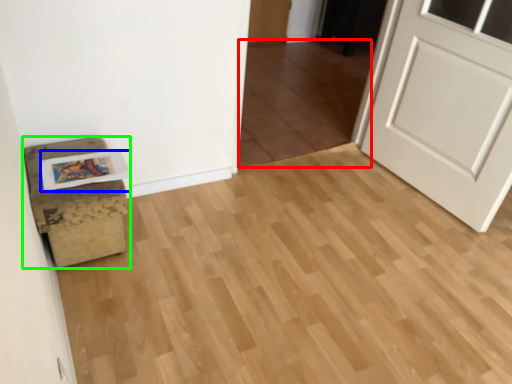
Question: Based on their relative distances, which object is farther from tile (highlighted by a red box)? Choose from postcard (highlighted by a blue box) and furniture (highlighted by a green box).

Choices:
 (A) postcard
 (B) furniture

Answer: (A)